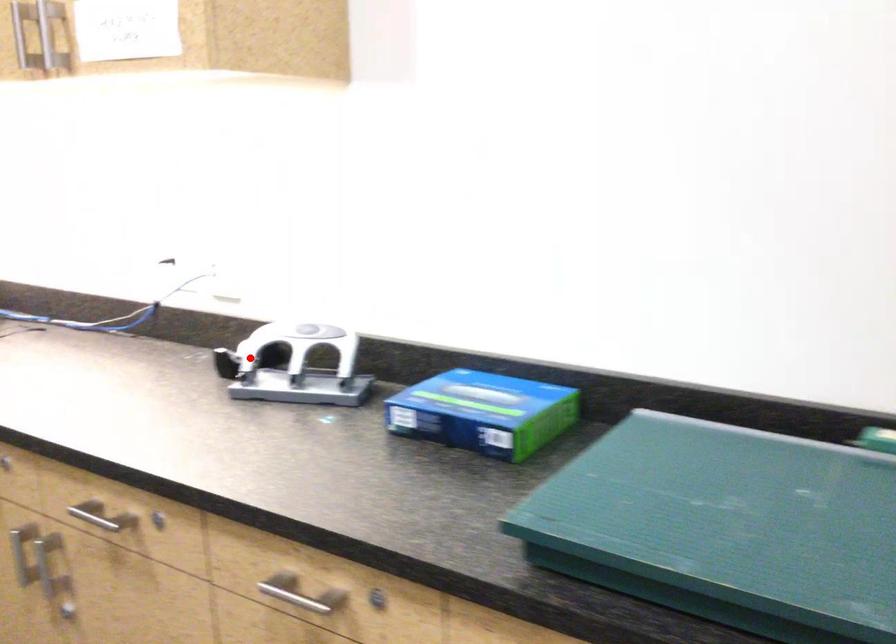
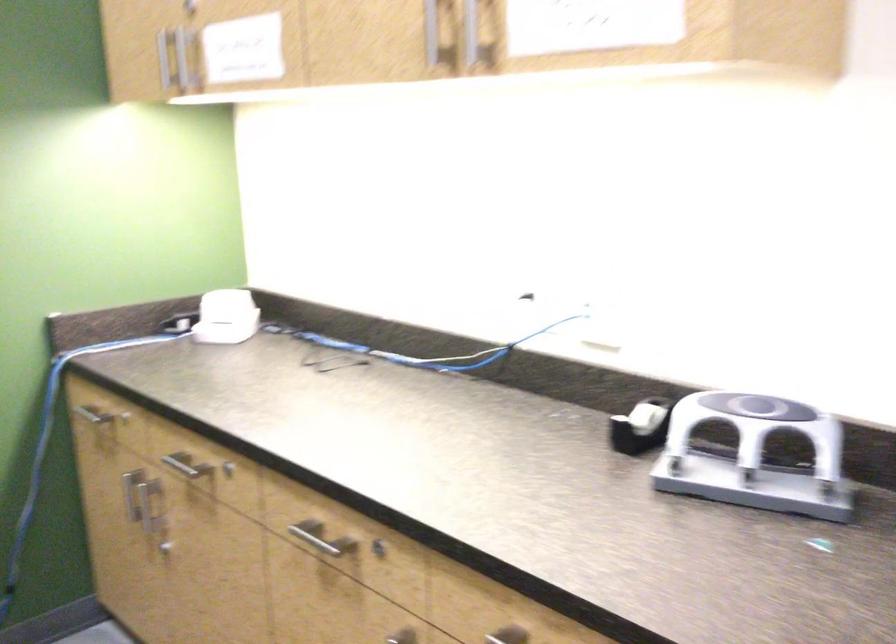
The point at the highlighted location is marked in the first image. Where is the corresponding point in the second image?

(641, 427)